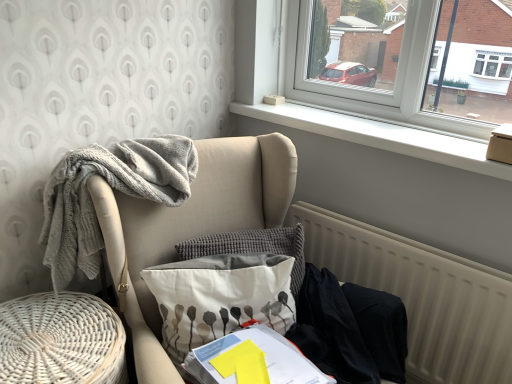
Question: From a real-world perspective, does white woven basket at lower left stand above white smooth window sill at upper center?

Choices:
 (A) yes
 (B) no

Answer: (B)

Question: Is white woven basket at lower left located outside white smooth window sill at upper center?

Choices:
 (A) yes
 (B) no

Answer: (A)

Question: Would you say white smooth window sill at upper center is part of white woven basket at lower left's contents?

Choices:
 (A) yes
 (B) no

Answer: (B)

Question: From a real-world perspective, is white woven basket at lower left physically below white smooth window sill at upper center?

Choices:
 (A) yes
 (B) no

Answer: (A)

Question: Does white woven basket at lower left have a larger size compared to white smooth window sill at upper center?

Choices:
 (A) no
 (B) yes

Answer: (B)

Question: From a real-world perspective, is beige textured radiator at lower right physically located above or below white fabric pillow with gray floral pattern at center, placed as the first pillow when sorted from front to back?

Choices:
 (A) below
 (B) above

Answer: (A)

Question: From the image's perspective, is beige textured radiator at lower right positioned above or below white fabric pillow with gray floral pattern at center, the 2th pillow when ordered from back to front?

Choices:
 (A) below
 (B) above

Answer: (A)

Question: In the image, is beige textured radiator at lower right on the left side or the right side of white fabric pillow with gray floral pattern at center, the 2th pillow when ordered from back to front?

Choices:
 (A) right
 (B) left

Answer: (A)

Question: Is point (417, 289) closer or farther from the camera than point (152, 289)?

Choices:
 (A) farther
 (B) closer

Answer: (A)

Question: From their relative heights in the image, would you say black fabric at lower right is taller or shorter than textured gray pillow at center, which is the 2th pillow in front-to-back order?

Choices:
 (A) short
 (B) tall

Answer: (B)

Question: From a real-world perspective, is black fabric at lower right positioned above or below textured gray pillow at center, which is the first pillow in back-to-front order?

Choices:
 (A) above
 (B) below

Answer: (B)

Question: From the image's perspective, relative to textured gray pillow at center, which is the first pillow in back-to-front order, is black fabric at lower right above or below?

Choices:
 (A) below
 (B) above

Answer: (A)

Question: Is black fabric at lower right spatially inside textured gray pillow at center, which is the first pillow in back-to-front order, or outside of it?

Choices:
 (A) outside
 (B) inside

Answer: (A)

Question: Considering the relative positions of textured beige armchair at left and white woven basket at lower left in the image provided, is textured beige armchair at left to the left or to the right of white woven basket at lower left?

Choices:
 (A) right
 (B) left

Answer: (A)

Question: Considering the positions of textured beige armchair at left and white woven basket at lower left in the image, is textured beige armchair at left taller or shorter than white woven basket at lower left?

Choices:
 (A) tall
 (B) short

Answer: (A)